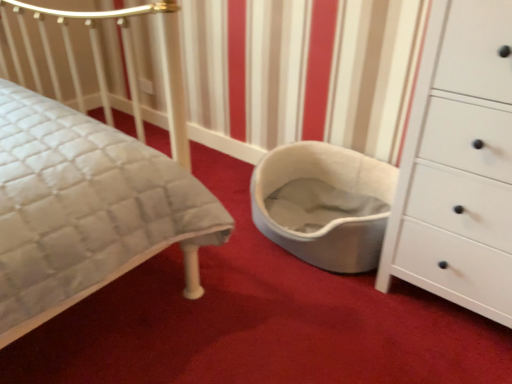
In order to click on free space in front of soft gray fabric pet bed at center in this screenshot , I will do pos(325,321).